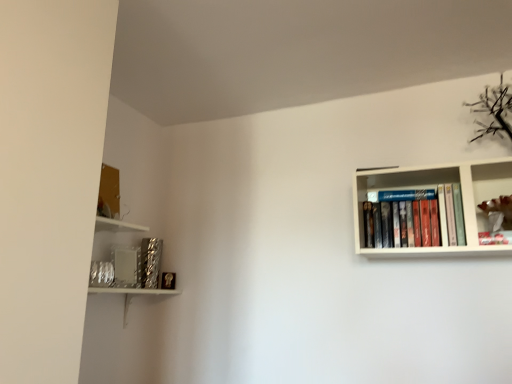
The height and width of the screenshot is (384, 512). Describe the element at coordinates (150, 262) in the screenshot. I see `metallic textured book at lower left` at that location.

I want to click on hardcover books at upper right, so click(x=415, y=217).

Identify the location of metallic silver frame at upper right. This screenshot has height=384, width=512. [493, 201].

Which object is wider, hardcover books at upper right or metallic silver frame at upper right?

Wider between the two is metallic silver frame at upper right.

Could you tell me if hardcover books at upper right is facing metallic silver frame at upper right?

No, hardcover books at upper right is not aimed at metallic silver frame at upper right.

From a real-world perspective, does hardcover books at upper right stand above metallic silver frame at upper right?

Yes, from a real-world perspective, hardcover books at upper right is above metallic silver frame at upper right.

The image size is (512, 384). Identify the location of shelf located in front of the hardcover books at upper right. (493, 201).

Who is shorter, metallic silver frame at upper right or hardcover books at upper right?

metallic silver frame at upper right is shorter.

In terms of size, does metallic silver frame at upper right appear bigger or smaller than hardcover books at upper right?

metallic silver frame at upper right is smaller than hardcover books at upper right.

Could you tell me if metallic silver frame at upper right is turned towards hardcover books at upper right?

No.

From the picture: How different are the orientations of metallic silver frame at upper right and hardcover books at upper right in degrees?

There is a 0.894-degree angle between the facing directions of metallic silver frame at upper right and hardcover books at upper right.

Considering the positions of points (499, 176) and (145, 281), is point (499, 176) farther from camera compared to point (145, 281)?

No, (499, 176) is in front of (145, 281).

Is metallic silver frame at upper right bigger or smaller than metallic textured book at lower left?

metallic silver frame at upper right is bigger than metallic textured book at lower left.

In the scene shown: Is metallic silver frame at upper right shorter than metallic textured book at lower left?

Correct, metallic silver frame at upper right is not as tall as metallic textured book at lower left.

Considering the relative positions of metallic silver frame at upper right and metallic textured book at lower left in the image provided, is metallic silver frame at upper right in front of metallic textured book at lower left?

Yes, it is.

Who is shorter, metallic textured book at lower left or metallic silver frame at upper right?

metallic silver frame at upper right.

At what (x,y) coordinates should I click in order to perform the action: click on shelf in front of the metallic textured book at lower left. Please return your answer as a coordinate pair (x, y). This screenshot has width=512, height=384. Looking at the image, I should click on (493, 201).

Between metallic textured book at lower left and metallic silver frame at upper right, which one has smaller size?

metallic textured book at lower left is smaller.

Which of these two, hardcover books at upper right or metallic textured book at lower left, is thinner?

metallic textured book at lower left is thinner.

Considering the relative positions of hardcover books at upper right and metallic textured book at lower left in the image provided, is hardcover books at upper right to the left of metallic textured book at lower left from the viewer's perspective?

No, hardcover books at upper right is not to the left of metallic textured book at lower left.

In the scene shown: Who is shorter, hardcover books at upper right or metallic textured book at lower left?

Standing shorter between the two is hardcover books at upper right.

Does point (382, 246) come in front of point (161, 251)?

Yes, it is.

Where is `book in front of the metallic textured book at lower left`? The width and height of the screenshot is (512, 384). book in front of the metallic textured book at lower left is located at coordinates (415, 217).

Between point (158, 265) and point (385, 225), which one is positioned in front?

Positioned in front is point (385, 225).

Who is shorter, metallic textured book at lower left or hardcover books at upper right?

hardcover books at upper right.

Is metallic textured book at lower left with hardcover books at upper right?

No.

Identify the location of book on the left of the metallic silver frame at upper right. This screenshot has height=384, width=512. (415, 217).

What are the coordinates of `book above the metallic silver frame at upper right (from a real-world perspective)` in the screenshot? It's located at (415, 217).

Looking at this image, from the image, which object appears to be nearer to hardcover books at upper right, metallic textured book at lower left or metallic silver frame at upper right?

metallic silver frame at upper right.

From the image, which object appears to be nearer to hardcover books at upper right, metallic silver frame at upper right or metallic textured book at lower left?

The object closer to hardcover books at upper right is metallic silver frame at upper right.

From the image, which object appears to be nearer to metallic textured book at lower left, hardcover books at upper right or metallic silver frame at upper right?

Among the two, hardcover books at upper right is located nearer to metallic textured book at lower left.

Estimate the real-world distances between objects in this image. Which object is closer to metallic silver frame at upper right, metallic textured book at lower left or hardcover books at upper right?

Among the two, hardcover books at upper right is located nearer to metallic silver frame at upper right.

When comparing their distances from metallic silver frame at upper right, does hardcover books at upper right or metallic textured book at lower left seem further?

The object further to metallic silver frame at upper right is metallic textured book at lower left.

When comparing their distances from metallic textured book at lower left, does metallic silver frame at upper right or hardcover books at upper right seem further?

metallic silver frame at upper right lies further to metallic textured book at lower left than the other object.

The height and width of the screenshot is (384, 512). In order to click on book between metallic textured book at lower left and metallic silver frame at upper right in this screenshot , I will do `click(415, 217)`.